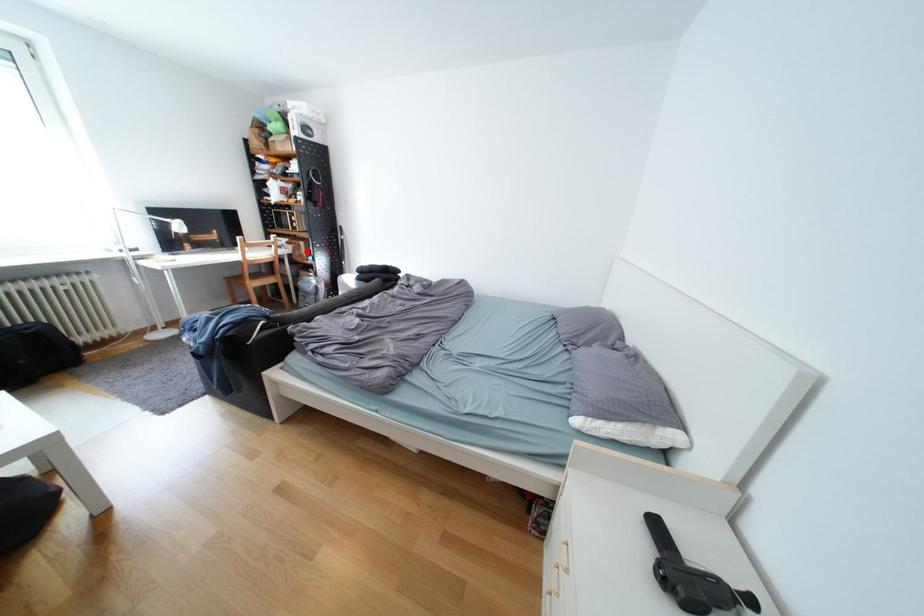
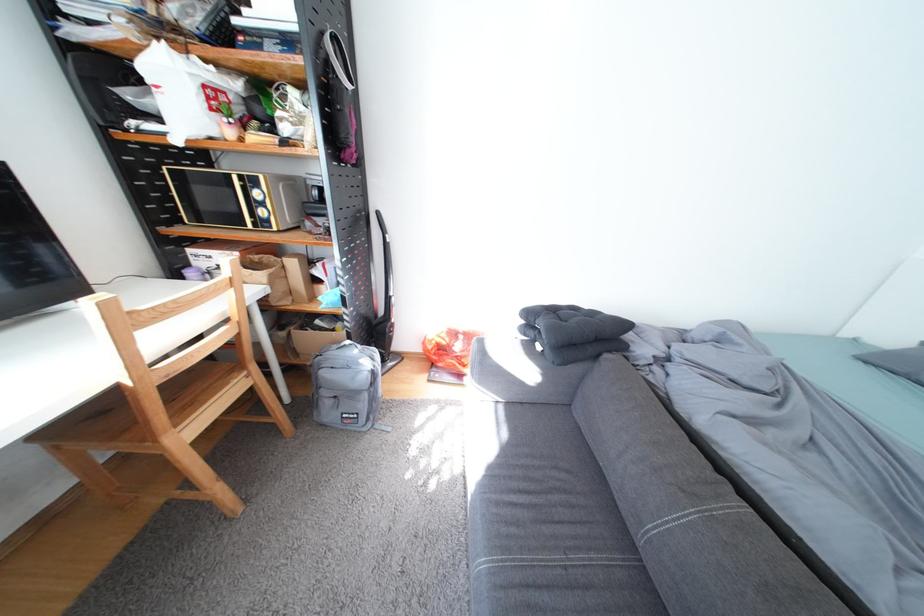
Where in the second image is the point corresponding to the highlighted location from the first image?

(285, 284)